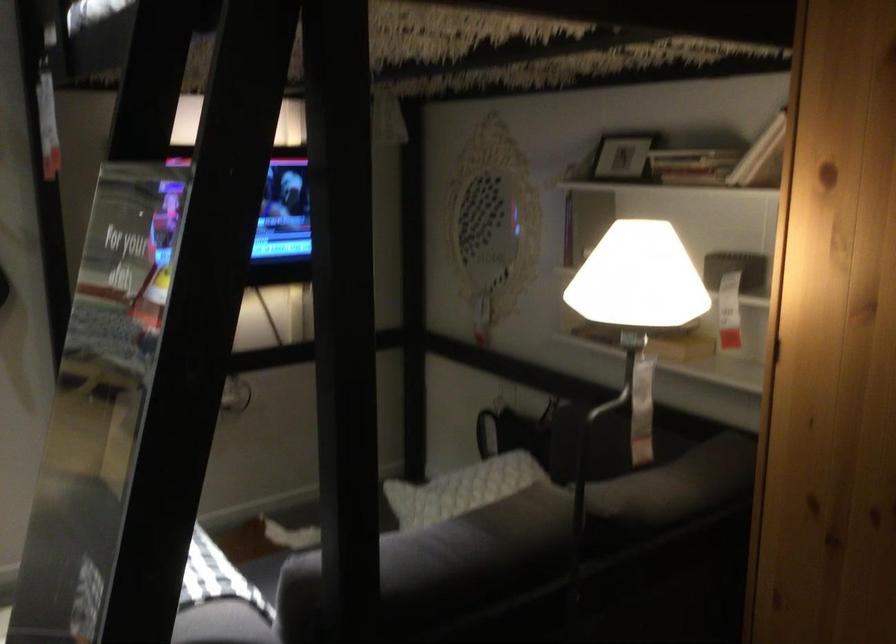
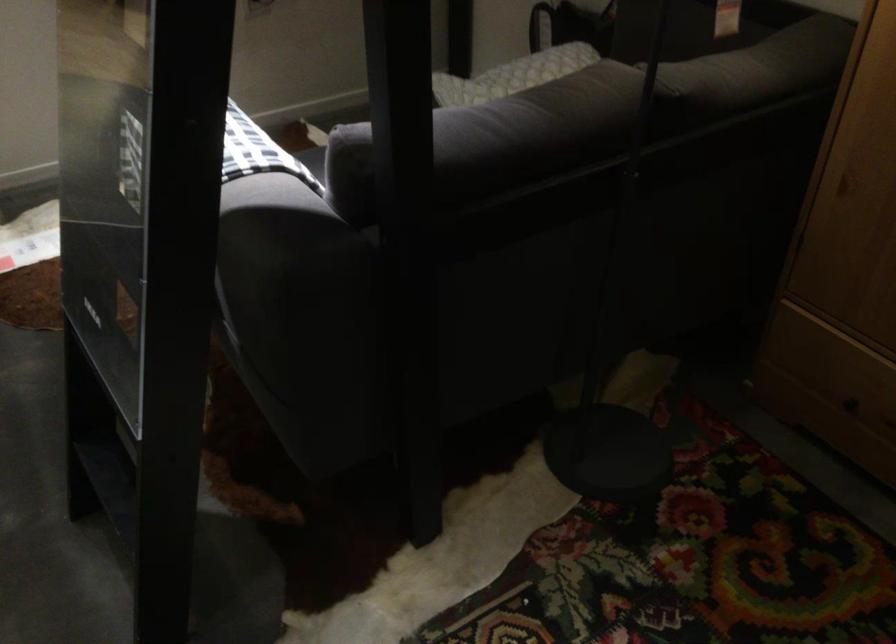
Find the pixel in the second image that matches pixel 467 569 in the first image.

(519, 140)